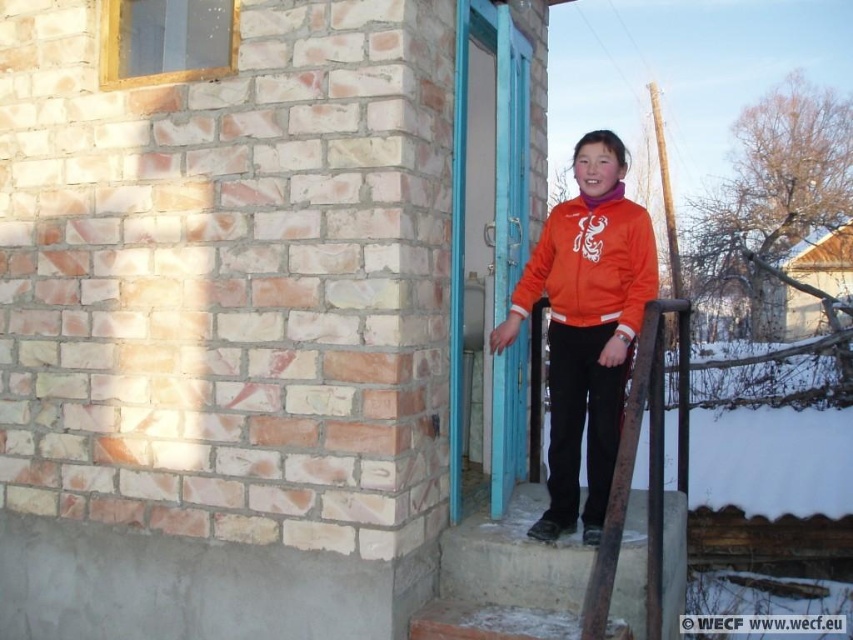
The height and width of the screenshot is (640, 853). Describe the element at coordinates (585, 326) in the screenshot. I see `orange fleece jacket at center` at that location.

Can you confirm if orange fleece jacket at center is positioned to the right of orange fleece sweatshirt at center?

Yes, orange fleece jacket at center is to the right of orange fleece sweatshirt at center.

Find the location of a particular element. Image resolution: width=853 pixels, height=640 pixels. orange fleece jacket at center is located at coordinates (585, 326).